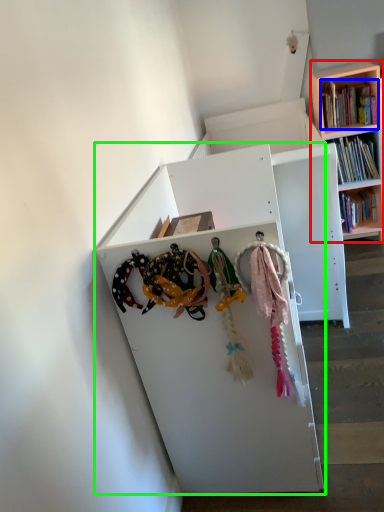
Question: Which object is the closest to the bookcase (highlighted by a red box)? Choose among these: book (highlighted by a blue box) or shelf (highlighted by a green box).

Choices:
 (A) book
 (B) shelf

Answer: (A)